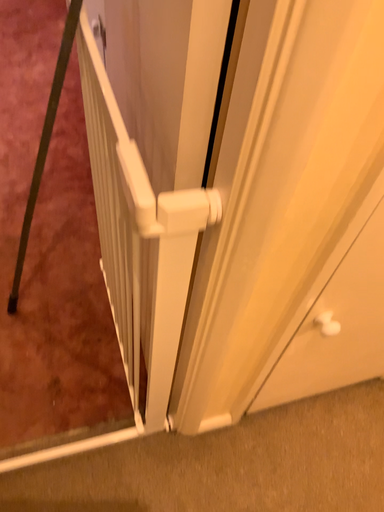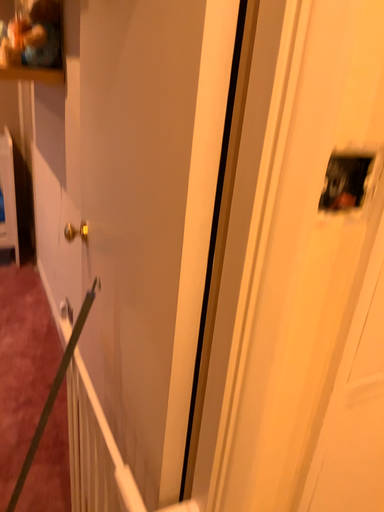
Question: Which way did the camera rotate in the video?

Choices:
 (A) rotated upward
 (B) rotated downward

Answer: (A)